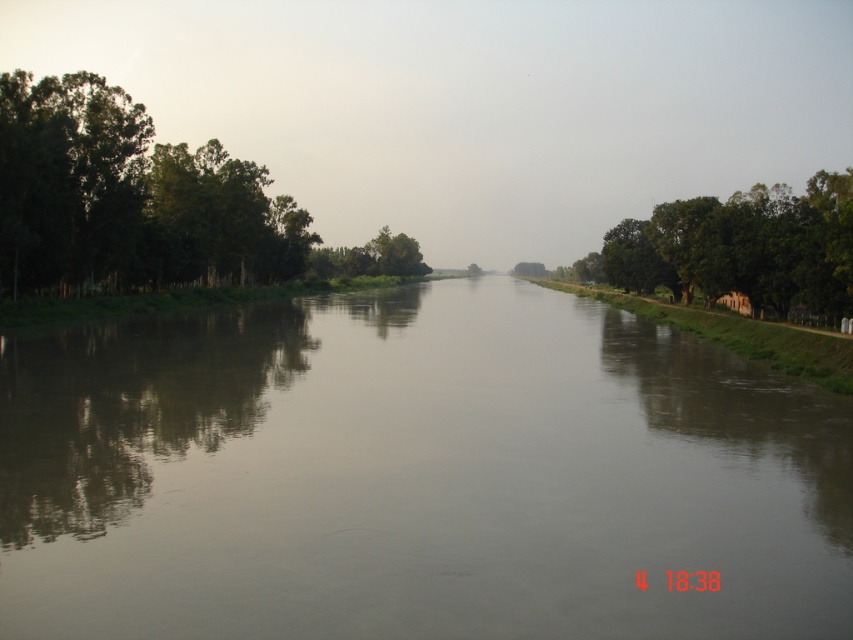
Is green leafy trees at left further to the viewer compared to green leafy trees at right?

Yes, it is behind green leafy trees at right.

This screenshot has width=853, height=640. What do you see at coordinates (144, 204) in the screenshot?
I see `green leafy trees at left` at bounding box center [144, 204].

Image resolution: width=853 pixels, height=640 pixels. What do you see at coordinates (144, 204) in the screenshot?
I see `green leafy trees at left` at bounding box center [144, 204].

What are the coordinates of `green leafy trees at left` in the screenshot? It's located at (144, 204).

Can you confirm if brown smooth water at center is positioned to the right of green leafy trees at right?

Incorrect, brown smooth water at center is not on the right side of green leafy trees at right.

Based on the photo, is brown smooth water at center closer to the viewer compared to green leafy trees at right?

Yes, brown smooth water at center is in front of green leafy trees at right.

The height and width of the screenshot is (640, 853). What do you see at coordinates (415, 474) in the screenshot?
I see `brown smooth water at center` at bounding box center [415, 474].

Find the location of a particular element. brown smooth water at center is located at coordinates (415, 474).

Is point (703, 200) positioned after point (322, 269)?

That is False.

Is the position of green leafy trees at right more distant than that of green leafy tree at center?

No, green leafy trees at right is in front of green leafy tree at center.

Between point (799, 225) and point (351, 273), which one is positioned in front?

Point (799, 225)

At what (x,y) coordinates should I click in order to perform the action: click on green leafy trees at right. Please return your answer as a coordinate pair (x, y). This screenshot has width=853, height=640. Looking at the image, I should click on (741, 246).